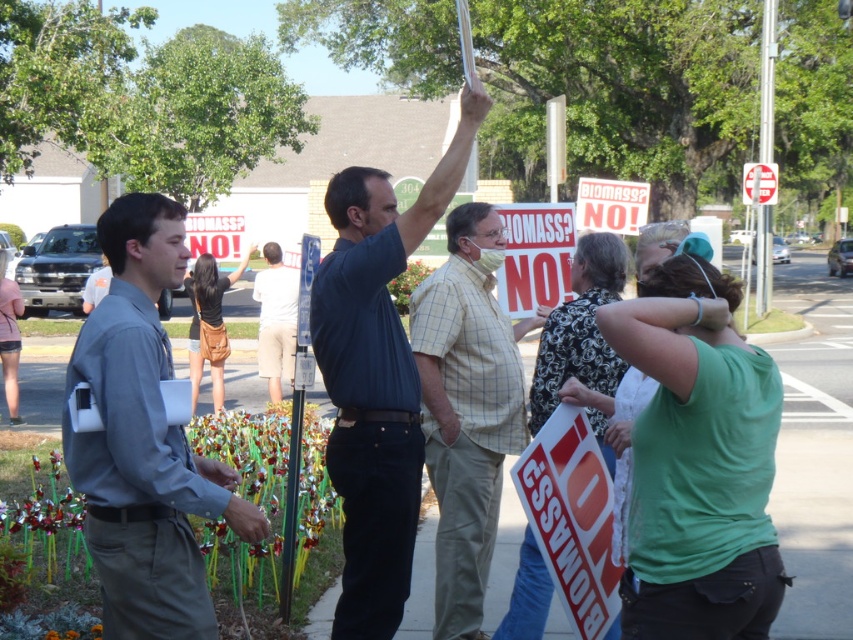
You are organizing a photo shoot and need to arrange two items in a scene. You have a gray shirt at left and a white cotton shorts at center. Which item is narrower in width?

The gray shirt at left has a lesser width compared to white cotton shorts at center, so the gray shirt at left is narrower in width.

Consider the image. You are a photographer trying to capture a clear shot of the light brown plaid shirt at center. However, the gray shirt at left is blocking your view. Based on the scene description, can you adjust your position to avoid the obstruction?

The gray shirt at left is positioned over the light brown plaid shirt at center, so moving your camera angle slightly downward or to the side might allow you to capture the light brown plaid shirt at center without the obstruction.

You are a photographer trying to capture a clear shot of the protest signs. You notice two people in the crowd wearing a gray shirt at left and a dark blue shirt at center. Which protester is more likely to block your view of the signs due to their body size?

The dark blue shirt at center is thicker than gray shirt at left, so the dark blue shirt at center is more likely to block your view of the signs due to their larger body size.